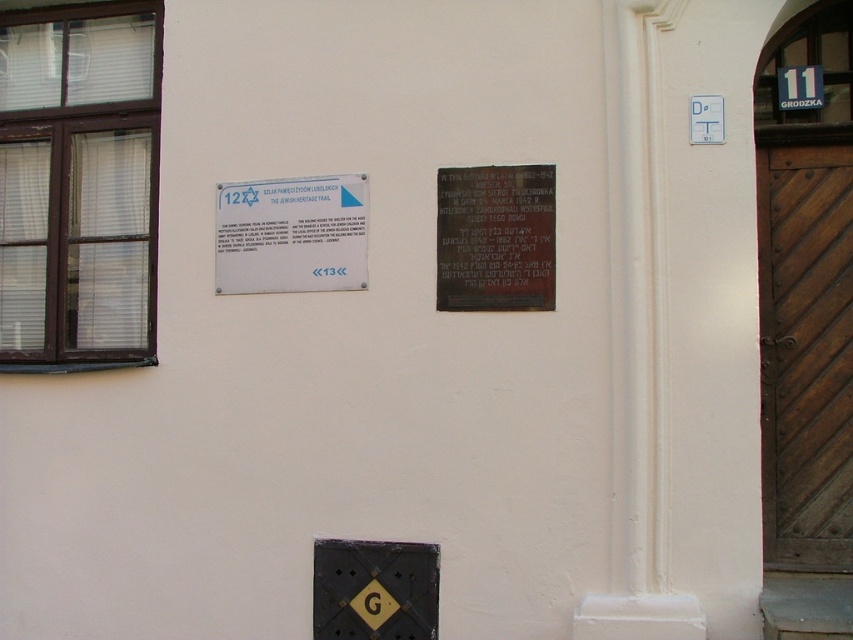
Question: Can you confirm if dark brown wooden door at right is positioned to the left of black polished stone plaque at center?

Choices:
 (A) yes
 (B) no

Answer: (B)

Question: Based on their relative distances, which object is nearer to the white paper sign at upper left?

Choices:
 (A) dark brown wooden door at right
 (B) black polished stone plaque at center

Answer: (B)

Question: Which is nearer to the white paper sign at upper left?

Choices:
 (A) dark brown wooden door at right
 (B) black polished stone plaque at center

Answer: (B)

Question: Does dark brown wooden door at right appear on the right side of white paper sign at upper left?

Choices:
 (A) no
 (B) yes

Answer: (B)

Question: Which of the following is the farthest from the observer?

Choices:
 (A) (473, 172)
 (B) (814, 448)

Answer: (B)

Question: Can you confirm if white paper sign at upper left is smaller than black polished stone plaque at center?

Choices:
 (A) yes
 (B) no

Answer: (B)